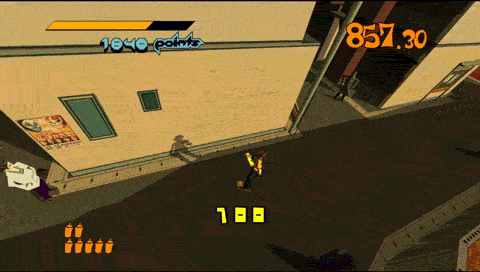
The width and height of the screenshot is (480, 272). Find the location of `timer`. timer is located at coordinates (384, 36).